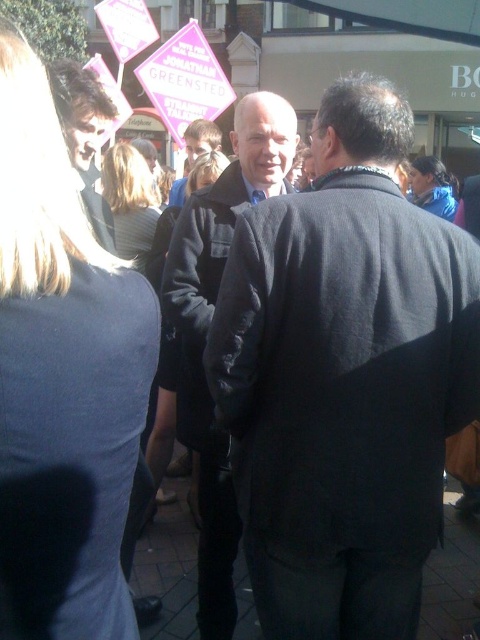
Question: Can you confirm if dark gray coat at center is positioned to the left of dark brown hair at upper left?

Choices:
 (A) no
 (B) yes

Answer: (A)

Question: Is dark gray coat at center wider than matte black coat at center?

Choices:
 (A) yes
 (B) no

Answer: (A)

Question: Which point is closer to the camera?

Choices:
 (A) (239, 419)
 (B) (190, 157)
 (C) (98, 88)
 (D) (288, 163)

Answer: (A)

Question: Can you confirm if dark gray coat at center is positioned to the left of matte black coat at center?

Choices:
 (A) no
 (B) yes

Answer: (A)

Question: Estimate the real-world distances between objects in this image. Which object is closer to the dark gray coat at center?

Choices:
 (A) dark brown hair at upper left
 (B) smooth black jacket at center

Answer: (A)

Question: Which point is closer to the camera taking this photo?

Choices:
 (A) (399, 620)
 (B) (218, 483)

Answer: (A)